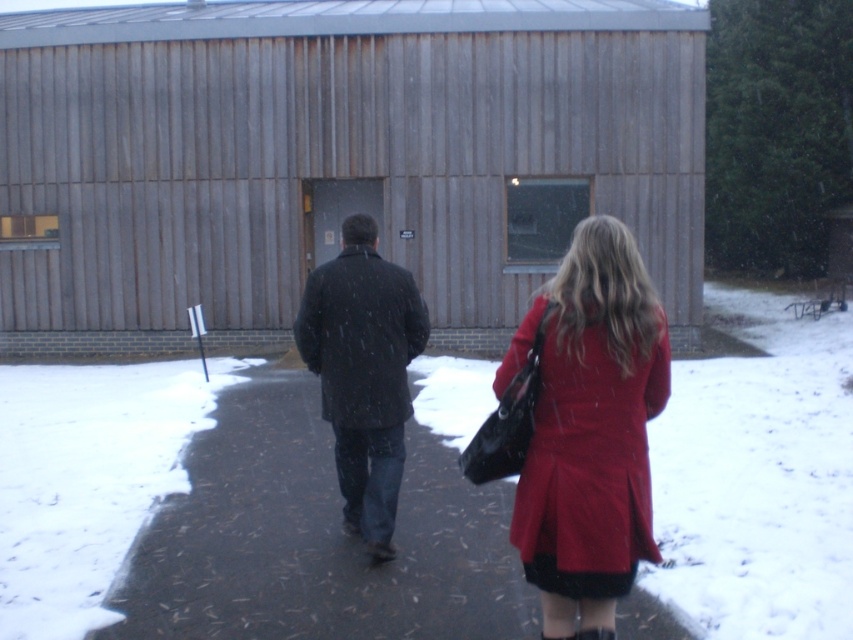
Question: Can you confirm if matte black coat at center is positioned to the left of matte red coat at center?

Choices:
 (A) yes
 (B) no

Answer: (B)

Question: Does wooden barn at center appear on the right side of matte black coat at center?

Choices:
 (A) no
 (B) yes

Answer: (A)

Question: From the image, what is the correct spatial relationship of wooden barn at center in relation to glossy asphalt at center?

Choices:
 (A) below
 (B) above

Answer: (B)

Question: Which object appears closest to the camera in this image?

Choices:
 (A) matte red coat at center
 (B) dark matte coat at center
 (C) matte black coat at center
 (D) glossy asphalt at center

Answer: (A)

Question: Estimate the real-world distances between objects in this image. Which object is closer to the wooden barn at center?

Choices:
 (A) matte red coat at center
 (B) dark matte coat at center
 (C) glossy asphalt at center
 (D) matte black coat at center

Answer: (B)

Question: Which of the following is the farthest from the observer?

Choices:
 (A) dark matte coat at center
 (B) wooden barn at center
 (C) glossy asphalt at center
 (D) matte black coat at center

Answer: (B)